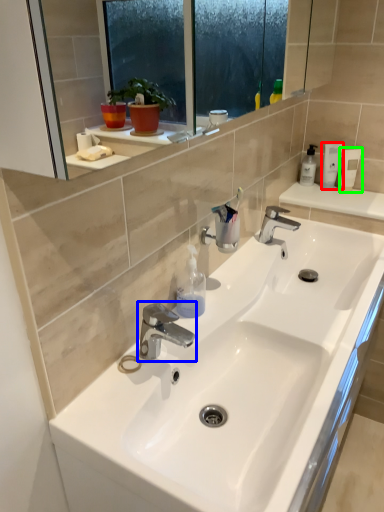
Question: Which object is positioned closest to toiletry (highlighted by a red box)? Select from tap (highlighted by a blue box) and mouthwash (highlighted by a green box).

Choices:
 (A) tap
 (B) mouthwash

Answer: (B)